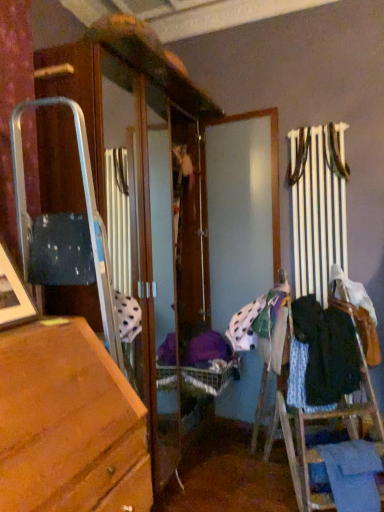
Question: Which is correct: dark blue fabric at right, which is counted as the 1th clothing, starting from the top, is inside blue fabric at lower right, which is the second clothing from top to bottom, or outside of it?

Choices:
 (A) inside
 (B) outside

Answer: (B)

Question: In terms of height, does dark blue fabric at right, the second clothing when ordered from bottom to top, look taller or shorter compared to blue fabric at lower right, positioned as the first clothing in bottom-to-top order?

Choices:
 (A) tall
 (B) short

Answer: (A)

Question: Considering their positions, is dark blue fabric at right, which is counted as the 1th clothing, starting from the top, located in front of or behind blue fabric at lower right, positioned as the first clothing in bottom-to-top order?

Choices:
 (A) front
 (B) behind

Answer: (B)

Question: Is point (367, 448) closer or farther from the camera than point (317, 374)?

Choices:
 (A) closer
 (B) farther

Answer: (A)

Question: From the image's perspective, is blue fabric at lower right, which is the second clothing from top to bottom, located above or below dark blue fabric at right, which is counted as the 1th clothing, starting from the top?

Choices:
 (A) below
 (B) above

Answer: (A)

Question: Considering the positions of blue fabric at lower right, positioned as the first clothing in bottom-to-top order, and dark blue fabric at right, which is counted as the 1th clothing, starting from the top, in the image, is blue fabric at lower right, positioned as the first clothing in bottom-to-top order, bigger or smaller than dark blue fabric at right, which is counted as the 1th clothing, starting from the top,?

Choices:
 (A) big
 (B) small

Answer: (B)

Question: Is blue fabric at lower right, positioned as the first clothing in bottom-to-top order, wider or thinner than dark blue fabric at right, which is counted as the 1th clothing, starting from the top?

Choices:
 (A) wide
 (B) thin

Answer: (B)